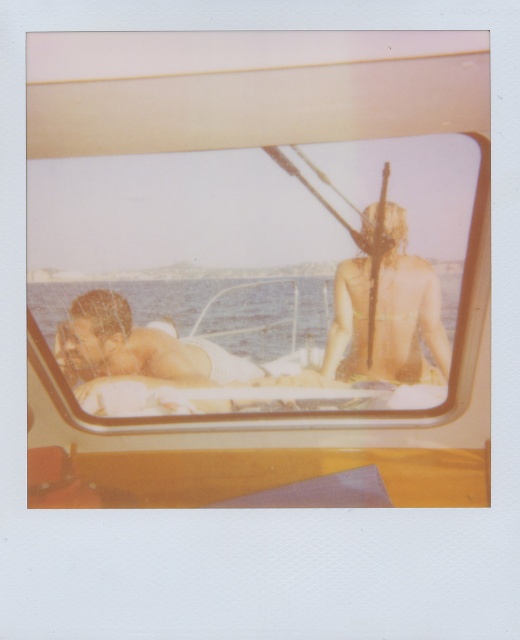
Question: Which object is the farthest from the wooden boat at center?

Choices:
 (A) golden tan skin at center
 (B) smooth white towel at center

Answer: (B)

Question: Which object appears closest to the camera in this image?

Choices:
 (A) golden tan skin at center
 (B) smooth white towel at center

Answer: (B)

Question: From the image, what is the correct spatial relationship of wooden boat at center in relation to golden tan skin at center?

Choices:
 (A) above
 (B) below

Answer: (A)

Question: Which object is the closest to the golden tan skin at center?

Choices:
 (A) smooth white towel at center
 (B) wooden boat at center

Answer: (A)

Question: Can you confirm if wooden boat at center is positioned above smooth white towel at center?

Choices:
 (A) no
 (B) yes

Answer: (B)

Question: Is the position of wooden boat at center less distant than that of smooth white towel at center?

Choices:
 (A) no
 (B) yes

Answer: (B)